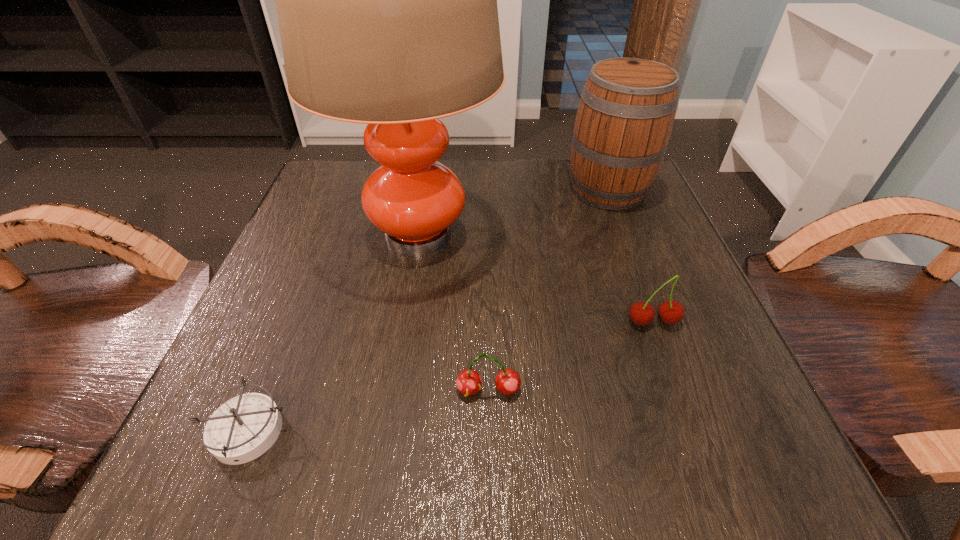
Identify the location of free point located 0.070m on the right of the compass. This screenshot has height=540, width=960. (345, 431).

The image size is (960, 540). In order to click on lamp present at the far edge in this screenshot , I will do `click(386, 0)`.

You are a GUI agent. You are given a task and a screenshot of the screen. Output one action in this format:
    pyautogui.click(x=<x>, y=<y>)
    Task: Click on the cider positioned at the far edge
    The image size is (960, 540).
    Given the screenshot: What is the action you would take?
    pyautogui.click(x=627, y=108)

Locate an element on the screen. This screenshot has height=540, width=960. object at the near edge is located at coordinates (243, 428).

Where is `lamp at the left edge`? This screenshot has height=540, width=960. lamp at the left edge is located at coordinates (386, 0).

Locate an element on the screen. The image size is (960, 540). compass positioned at the left edge is located at coordinates (243, 428).

The width and height of the screenshot is (960, 540). Identify the location of cider located at the right edge. (627, 108).

The height and width of the screenshot is (540, 960). I want to click on cherry that is at the right edge, so (x=670, y=312).

Where is `object at the far left corner`? object at the far left corner is located at coordinates point(386,0).

Where is `object situated at the near left corner`? This screenshot has height=540, width=960. object situated at the near left corner is located at coordinates (243, 428).